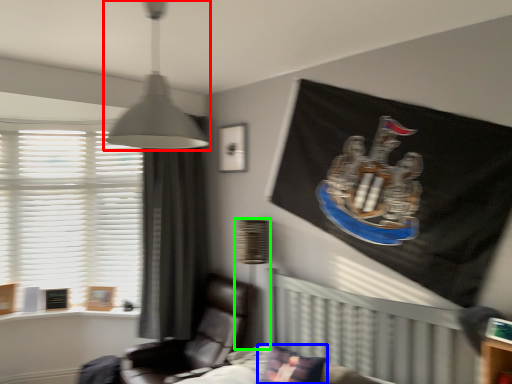
Question: Which is nearer to the lamp (highlighted by a red box)? pillow (highlighted by a blue box) or table lamp (highlighted by a green box).

Choices:
 (A) pillow
 (B) table lamp

Answer: (A)